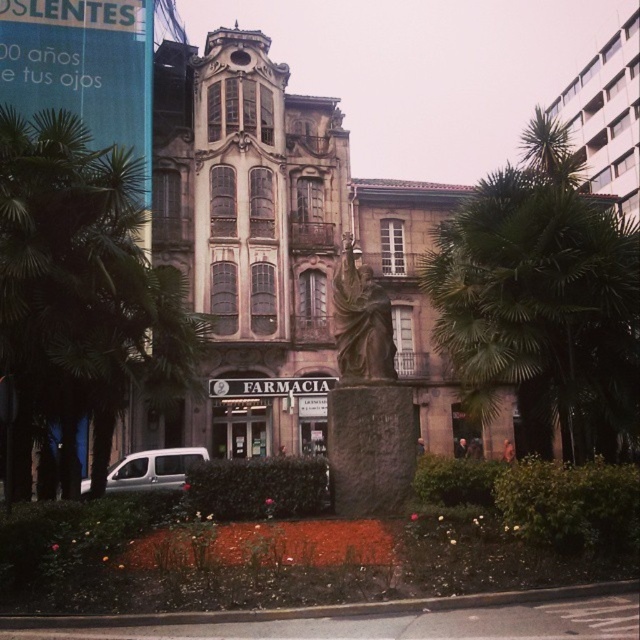
Is point (577, 417) farther from camera compared to point (81, 307)?

Yes.

Is point (556, 340) closer to viewer compared to point (140, 259)?

Yes.

Between point (534, 112) and point (76, 163), which one is positioned behind?

The point (534, 112) is behind.

Identify the location of green leafy palm tree at center. (541, 300).

Which is above, green leafy palm tree at center or white matte van at lower left?

green leafy palm tree at center is above.

In the scene shown: Is green leafy palm tree at center shorter than white matte van at lower left?

No.

Does point (627, 428) come closer to viewer compared to point (160, 481)?

Yes, it is.

Where is `green leafy palm tree at center`? This screenshot has height=640, width=640. green leafy palm tree at center is located at coordinates (541, 300).

Which is behind, point (10, 483) or point (156, 449)?

Positioned behind is point (156, 449).

Based on the photo, who is positioned more to the right, green leafy palm tree at left or white matte van at lower left?

white matte van at lower left

The image size is (640, 640). I want to click on green leafy palm tree at left, so click(81, 285).

Identify the location of green leafy palm tree at left. (81, 285).